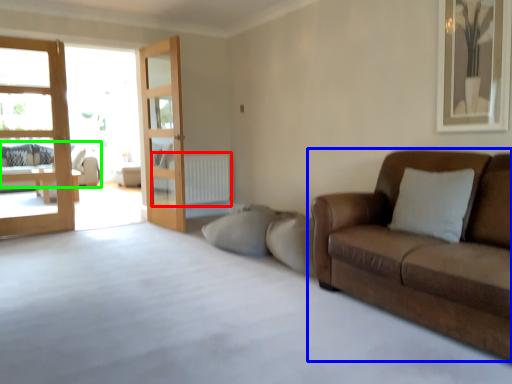
Question: Which object is the farthest from radiator (highlighted by a red box)? Choose among these: studio couch (highlighted by a blue box) or studio couch (highlighted by a green box).

Choices:
 (A) studio couch
 (B) studio couch

Answer: (A)